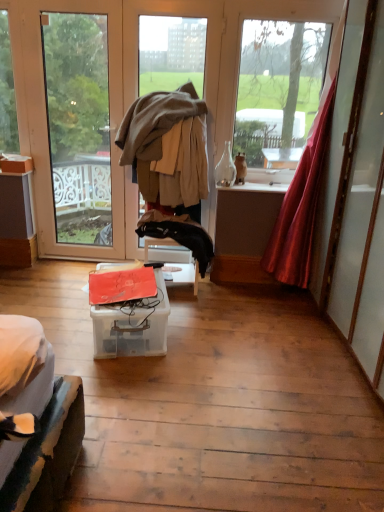
This screenshot has width=384, height=512. What do you see at coordinates (16, 163) in the screenshot?
I see `matte cardboard box at left, acting as the second box starting from the bottom` at bounding box center [16, 163].

What do you see at coordinates (300, 208) in the screenshot? This screenshot has width=384, height=512. I see `satin red curtain at right` at bounding box center [300, 208].

What is the approximate width of black fabric jacket at center?

8.91 inches.

Measure the distance between transparent glass door at left, which is counted as the first window, starting from the left, and camera.

They are 3.96 meters apart.

Find the location of a particular element. matte cardboard box at left, which is counted as the first box, starting from the left is located at coordinates (16, 163).

From the image's perspective, which is above, beige woolen jacket at center or black fabric jacket at center?

beige woolen jacket at center appears higher in the image.

How many degrees apart are the facing directions of beige woolen jacket at center and black fabric jacket at center?

0.0278 degrees.

Is beige woolen jacket at center in front of or behind black fabric jacket at center in the image?

In the image, beige woolen jacket at center appears in front of black fabric jacket at center.

Is matte brown vase at upper center wider or thinner than transparent glass window at upper right, which is the 2th window in left-to-right order?

matte brown vase at upper center is wider than transparent glass window at upper right, which is the 2th window in left-to-right order.

Is matte brown vase at upper center facing away from transparent glass window at upper right, which is counted as the first window, starting from the right?

Yes, matte brown vase at upper center's orientation is away from transparent glass window at upper right, which is counted as the first window, starting from the right.

Can you tell me how much matte brown vase at upper center and transparent glass window at upper right, which is counted as the first window, starting from the right, differ in facing direction?

They differ by 0.000394 degrees in their facing directions.

Are matte brown vase at upper center and transparent glass window at upper right, which is the 2th window in left-to-right order, far apart?

That's not correct — matte brown vase at upper center is a little close to transparent glass window at upper right, which is the 2th window in left-to-right order.

Is beige woolen jacket at center positioned behind transparent plastic box at center, the 1th box ordered from the bottom?

Yes, it is behind transparent plastic box at center, the 1th box ordered from the bottom.

Which is correct: beige woolen jacket at center is inside transparent plastic box at center, which ranks as the 2th box in left-to-right order, or outside of it?

beige woolen jacket at center lies outside transparent plastic box at center, which ranks as the 2th box in left-to-right order.

You are a GUI agent. You are given a task and a screenshot of the screen. Output one action in this format:
    pyautogui.click(x=<x>, y=<y>)
    Task: Click on the jacket that is behind the transparent plastic box at center, the 1th box ordered from the bottom
    
    Given the screenshot: What is the action you would take?
    pyautogui.click(x=154, y=130)

Are beige woolen jacket at center and transparent plastic box at center, the 2th box in the top-to-bottom sequence, located far from each other?

Yes, beige woolen jacket at center and transparent plastic box at center, the 2th box in the top-to-bottom sequence, are quite far apart.

Is point (230, 161) closer to viewer compared to point (0, 163)?

No.

Which object is thinner, clear glass bottle at center or matte cardboard box at left, which ranks as the first box in back-to-front order?

Thinner between the two is clear glass bottle at center.

Does clear glass bottle at center come in front of matte cardboard box at left, which appears as the 1th box when viewed from the top?

Yes, clear glass bottle at center is closer to the camera.

Is clear glass bottle at center spatially inside matte cardboard box at left, positioned as the 2th box in front-to-back order, or outside of it?

clear glass bottle at center is outside matte cardboard box at left, positioned as the 2th box in front-to-back order.

Is matte cardboard box at left, acting as the second box starting from the bottom, closer to camera compared to transparent glass window at upper right, which is counted as the first window, starting from the right?

No, it is not.

This screenshot has width=384, height=512. Find the location of `the 2nd window in front when counting from the matte cardboard box at left, which ranks as the first box in back-to-front order`. the 2nd window in front when counting from the matte cardboard box at left, which ranks as the first box in back-to-front order is located at coordinates (278, 85).

Considering the sizes of objects matte cardboard box at left, positioned as the 2th box in front-to-back order, and transparent glass window at upper right, which is the 2th window in left-to-right order, in the image provided, who is shorter, matte cardboard box at left, positioned as the 2th box in front-to-back order, or transparent glass window at upper right, which is the 2th window in left-to-right order,?

matte cardboard box at left, positioned as the 2th box in front-to-back order, is shorter.

In the scene shown: Considering the sizes of objects matte cardboard box at left, positioned as the 2th box in front-to-back order, and transparent glass window at upper right, which is the 2th window in left-to-right order, in the image provided, who is thinner, matte cardboard box at left, positioned as the 2th box in front-to-back order, or transparent glass window at upper right, which is the 2th window in left-to-right order,?

With smaller width is transparent glass window at upper right, which is the 2th window in left-to-right order.

Based on the photo, how far apart are transparent glass door at left, which is counted as the first window, starting from the left, and matte cardboard box at left, which appears as the 1th box when viewed from the top?

5.09 feet.

Consider the image. Is the surface of transparent glass door at left, marked as the second window in a right-to-left arrangement, in direct contact with matte cardboard box at left, positioned as the 2th box in front-to-back order?

No, transparent glass door at left, marked as the second window in a right-to-left arrangement, is not next to matte cardboard box at left, positioned as the 2th box in front-to-back order.

Which object is further away from the camera taking this photo, transparent glass door at left, marked as the second window in a right-to-left arrangement, or matte cardboard box at left, positioned as the 2th box in front-to-back order?

matte cardboard box at left, positioned as the 2th box in front-to-back order.

How different are the orientations of transparent glass door at left, which is counted as the first window, starting from the left, and matte cardboard box at left, which is counted as the first box, starting from the left, in degrees?

The angular difference between transparent glass door at left, which is counted as the first window, starting from the left, and matte cardboard box at left, which is counted as the first box, starting from the left, is 0.327 degrees.

Which is nearer, (225, 147) or (156, 275)?

Point (225, 147).

Between clear glass bottle at center and transparent plastic box at center, the 1th box ordered from the bottom, which one has smaller size?

clear glass bottle at center.

Can you confirm if clear glass bottle at center is shorter than transparent plastic box at center, the 2th box positioned from the back?

No, clear glass bottle at center is not shorter than transparent plastic box at center, the 2th box positioned from the back.

Do you think clear glass bottle at center is within transparent plastic box at center, the 2th box in the top-to-bottom sequence, or outside of it?

clear glass bottle at center is not inside transparent plastic box at center, the 2th box in the top-to-bottom sequence, it's outside.

Where is `jacket lying on the left of black fabric jacket at center`? This screenshot has width=384, height=512. jacket lying on the left of black fabric jacket at center is located at coordinates (154, 130).

From a real-world perspective, count 2nd windows upward from the matte brown vase at upper center and point to it. Please provide its 2D coordinates.

[(278, 85)]

From the image, which object appears to be farther from transparent glass window at upper right, which is the 2th window in left-to-right order, beige woolen jacket at center or transparent glass door at left, which is counted as the first window, starting from the left?

transparent glass door at left, which is counted as the first window, starting from the left, lies further to transparent glass window at upper right, which is the 2th window in left-to-right order, than the other object.

From the image, which object appears to be nearer to matte cardboard box at left, positioned as the 2th box in front-to-back order, beige woolen jacket at center or black fabric jacket at center?

Among the two, beige woolen jacket at center is located nearer to matte cardboard box at left, positioned as the 2th box in front-to-back order.

Estimate the real-world distances between objects in this image. Which object is further from matte brown vase at upper center, beige woolen jacket at center or black fabric jacket at center?

black fabric jacket at center is positioned further to the anchor matte brown vase at upper center.

Considering their positions, is matte cardboard box at left, the second box when ordered from right to left, positioned further to transparent glass door at left, marked as the second window in a right-to-left arrangement, than transparent glass window at upper right, which is the 2th window in left-to-right order?

Based on the image, transparent glass window at upper right, which is the 2th window in left-to-right order, appears to be further to transparent glass door at left, marked as the second window in a right-to-left arrangement.

From the image, which object appears to be farther from clear glass bottle at center, transparent plastic box at center, the 1th box ordered from the bottom, or transparent glass door at left, marked as the second window in a right-to-left arrangement?

The object further to clear glass bottle at center is transparent glass door at left, marked as the second window in a right-to-left arrangement.

Which object lies further to the anchor point beige woolen jacket at center, transparent glass door at left, which is counted as the first window, starting from the left, or black fabric jacket at center?

The object further to beige woolen jacket at center is transparent glass door at left, which is counted as the first window, starting from the left.

Looking at the image, which one is located closer to beige woolen jacket at center, matte brown vase at upper center or clear glass bottle at center?

clear glass bottle at center is closer to beige woolen jacket at center.

When comparing their distances from beige woolen jacket at center, does clear glass bottle at center or transparent plastic box at center, the 1th box ordered from the bottom, seem closer?

Among the two, clear glass bottle at center is located nearer to beige woolen jacket at center.

Where is `houseplant located between transparent glass door at left, which is counted as the first window, starting from the left, and transparent glass window at upper right, which is counted as the first window, starting from the right, in the left-right direction`? This screenshot has height=512, width=384. houseplant located between transparent glass door at left, which is counted as the first window, starting from the left, and transparent glass window at upper right, which is counted as the first window, starting from the right, in the left-right direction is located at coordinates (240, 168).

At what (x,y) coordinates should I click in order to perform the action: click on window between matte cardboard box at left, which is counted as the first box, starting from the left, and beige woolen jacket at center from left to right. Please return your answer as a coordinate pair (x, y). The width and height of the screenshot is (384, 512). Looking at the image, I should click on (83, 128).

This screenshot has width=384, height=512. Find the location of `clothing situated between transparent glass door at left, which is counted as the first window, starting from the left, and transparent glass window at upper right, which is counted as the first window, starting from the right, from left to right`. clothing situated between transparent glass door at left, which is counted as the first window, starting from the left, and transparent glass window at upper right, which is counted as the first window, starting from the right, from left to right is located at coordinates (179, 234).

The image size is (384, 512). What are the coordinates of `jacket located between matte cardboard box at left, which is counted as the first box, starting from the left, and matte brown vase at upper center in the left-right direction` in the screenshot? It's located at (154, 130).